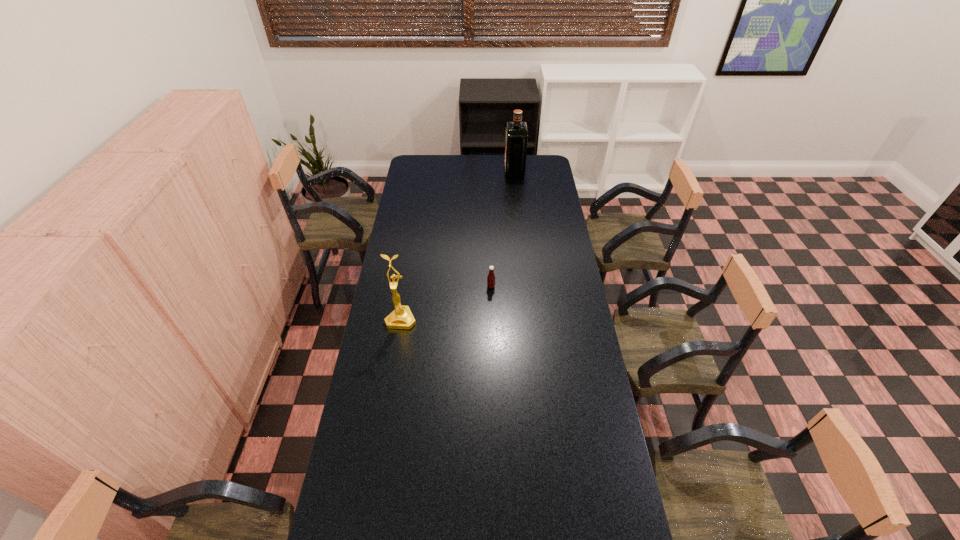
At what (x,y) coordinates should I click in order to perform the action: click on vacant area situated 0.100m on the front of the Tabasco sauce. Please return your answer as a coordinate pair (x, y). The width and height of the screenshot is (960, 540). Looking at the image, I should click on (x=492, y=306).

This screenshot has width=960, height=540. I want to click on object present at the far edge, so click(516, 141).

Find the location of a particular element. object that is positioned at the left edge is located at coordinates (401, 318).

Where is `vacant space at the far edge`? This screenshot has width=960, height=540. vacant space at the far edge is located at coordinates (460, 159).

Identify the location of free spot at the left edge of the desktop. This screenshot has height=540, width=960. (339, 532).

The image size is (960, 540). I want to click on vacant space at the right edge of the desktop, so click(x=557, y=226).

The height and width of the screenshot is (540, 960). Find the location of `vacant space in between the second object from left to right and the award`. vacant space in between the second object from left to right and the award is located at coordinates 446,303.

You are a GUI agent. You are given a task and a screenshot of the screen. Output one action in this format:
    pyautogui.click(x=<x>, y=<y>)
    Task: Click on the vacant space that is in between the second nearest object and the farthest object
    
    Given the screenshot: What is the action you would take?
    pyautogui.click(x=503, y=229)

This screenshot has height=540, width=960. Identify the location of empty space between the second object from left to right and the award. (446, 303).

Locate an element on the screen. Image resolution: width=960 pixels, height=540 pixels. unoccupied area between the liquor and the shortest object is located at coordinates (503, 229).